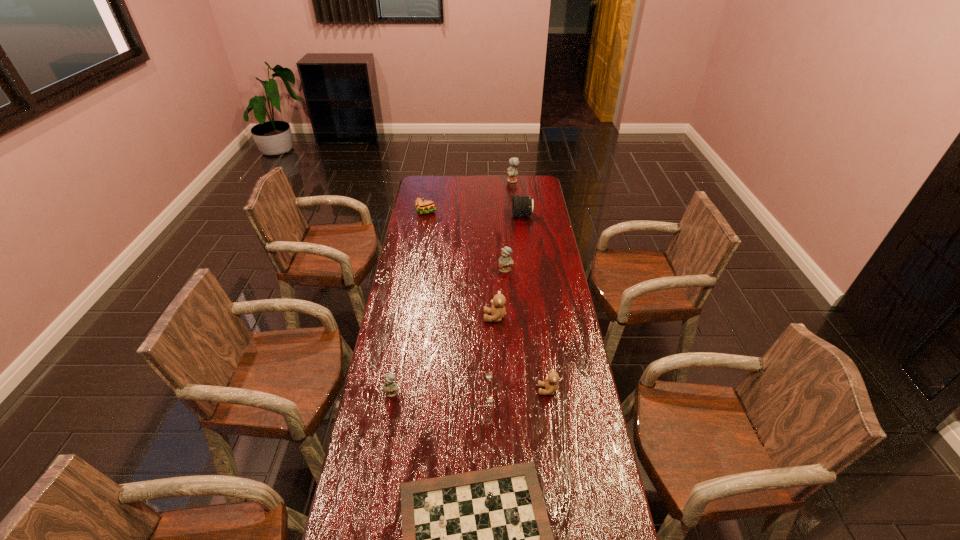
Image resolution: width=960 pixels, height=540 pixels. I want to click on the farthest blue teddy bear, so click(x=512, y=171).

Identify the location of the farthest object. The width and height of the screenshot is (960, 540). (512, 171).

Image resolution: width=960 pixels, height=540 pixels. I want to click on the third nearest teddy bear, so click(x=498, y=311).

The image size is (960, 540). I want to click on the bigger brown teddy bear, so click(498, 311).

In order to click on the second nearest blue teddy bear in this screenshot , I will do `click(505, 261)`.

Where is `the fourth nearest teddy bear`? The image size is (960, 540). the fourth nearest teddy bear is located at coordinates (505, 261).

The image size is (960, 540). I want to click on telephoto lens, so click(521, 205).

Identify the location of sandwich. (423, 206).

At what (x,y) coordinates should I click in order to perform the action: click on the right brown teddy bear. Please return your answer as a coordinate pair (x, y). The width and height of the screenshot is (960, 540). Looking at the image, I should click on [x=550, y=384].

Identify the location of the smaller brown teddy bear. This screenshot has height=540, width=960. (550, 384).